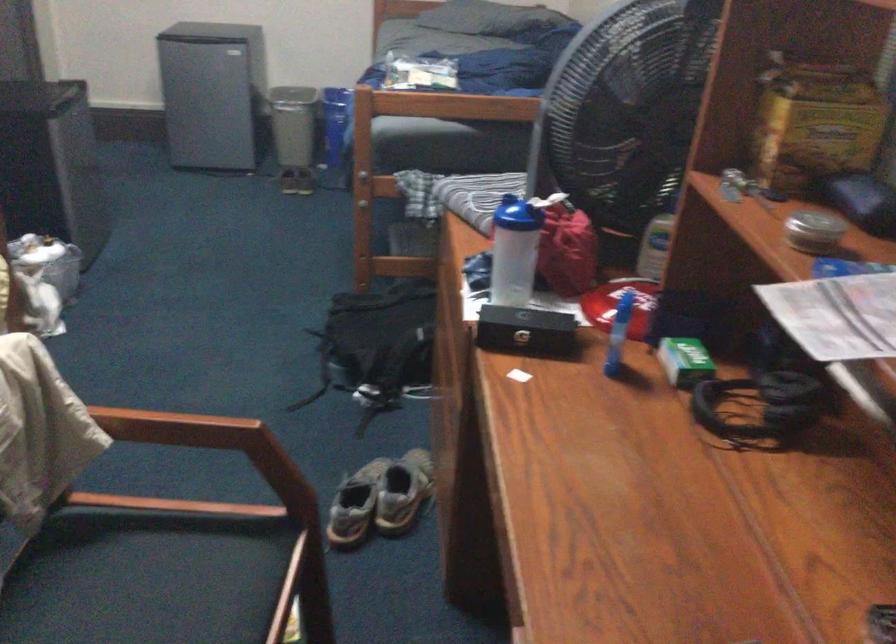
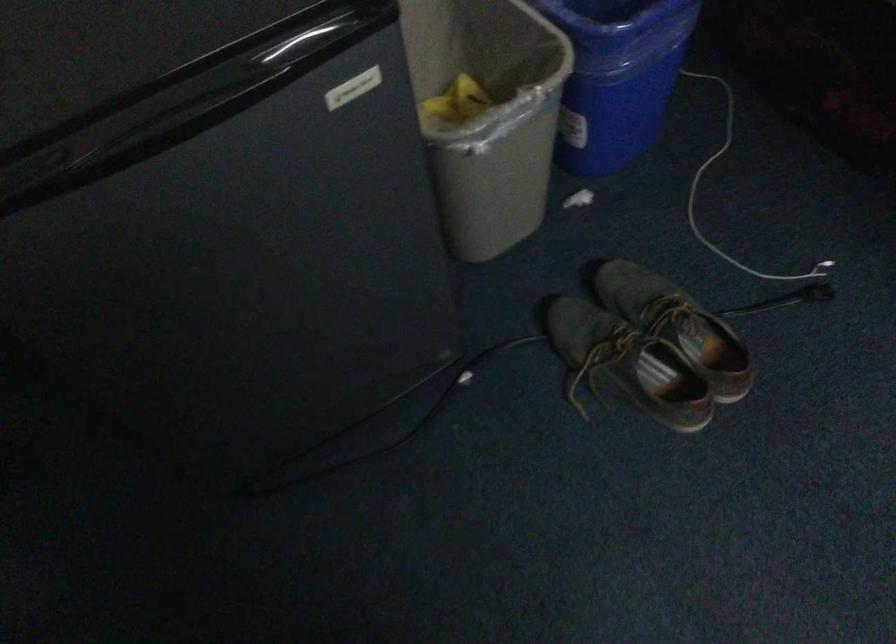
In the second image, find the point that corresponds to the point at 314,90 in the first image.

(616, 76)